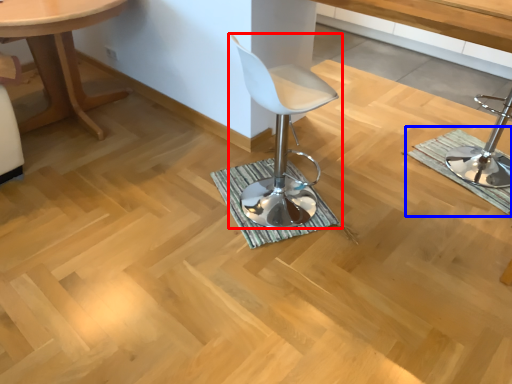
Question: Which of the following is the farthest to the observer, chair (highlighted by a red box) or bath mat (highlighted by a blue box)?

Choices:
 (A) chair
 (B) bath mat

Answer: (B)